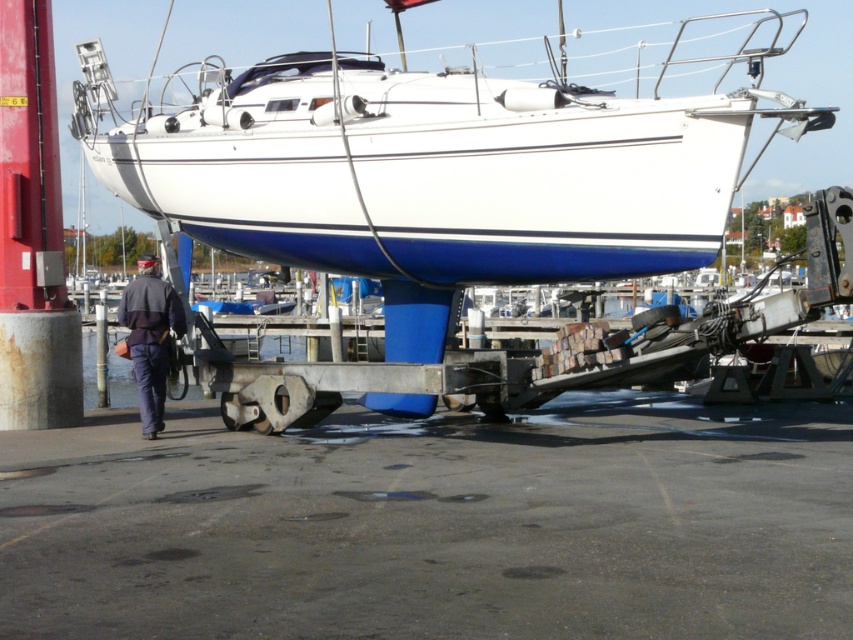
You are standing at the edge of the marina and see the white glossy boat at center and the dark blue uniform at lower left. Which object is nearer to you?

The white glossy boat at center is closer to the viewer than the dark blue uniform at lower left.